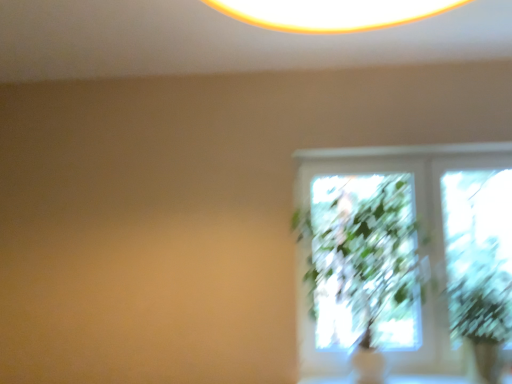
Question: Considering the positions of green leafy plant at right and green leafy plant at right in the image, is green leafy plant at right bigger or smaller than green leafy plant at right?

Choices:
 (A) small
 (B) big

Answer: (A)

Question: Is green leafy plant at right spatially inside green leafy plant at right, or outside of it?

Choices:
 (A) inside
 (B) outside

Answer: (B)

Question: Considering the positions of point (456, 266) and point (393, 334), is point (456, 266) closer or farther from the camera than point (393, 334)?

Choices:
 (A) closer
 (B) farther

Answer: (A)

Question: Is green leafy plant at right taller or shorter than green leafy plant at right?

Choices:
 (A) tall
 (B) short

Answer: (A)

Question: From the image's perspective, is green leafy plant at right above or below green leafy plant at right?

Choices:
 (A) below
 (B) above

Answer: (B)

Question: Would you say green leafy plant at right is to the left or to the right of green leafy plant at right in the picture?

Choices:
 (A) left
 (B) right

Answer: (A)

Question: Is green leafy plant at right bigger or smaller than green leafy plant at right?

Choices:
 (A) small
 (B) big

Answer: (B)